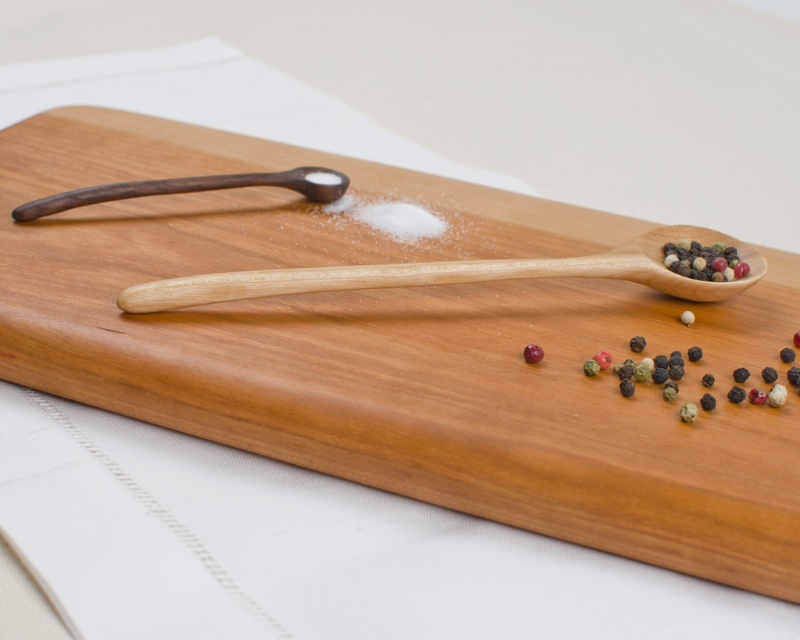
Looking at this image, you are a chef looking at the image. You need to place a new spice jar exactly at the position of the dark wood spoon at upper left. What are the coordinates where you should place the spice jar?

The coordinates for the dark wood spoon at upper left are at point (192, 188). Place the spice jar there.

You are a chef who needs to sprinkle the multicolored peppercorns at right onto a dish. You have a light wood spoon at center. Can you reach the peppercorns with the spoon without moving either?

The light wood spoon at center is 5.98 inches away from multicolored peppercorns at right. Since the spoon is about 6 inches long, you can reach the peppercorns by extending the spoon.

You are a chef trying to reach the glossy red pepper at center while holding the dark wood spoon at upper left. If your arm can extend 20 inches, can you reach the pepper without moving the spoon?

The dark wood spoon at upper left is 20.30 inches from the glossy red pepper at center, which is just beyond your arm extension of 20 inches. Therefore, you cannot reach the pepper without moving the spoon.